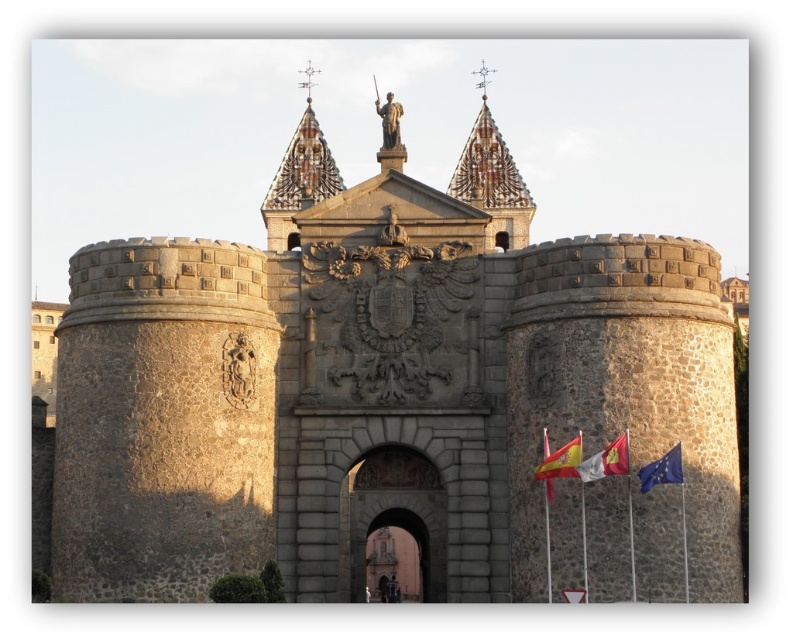
Where is `white fabric flag at lower right`? The image size is (793, 640). white fabric flag at lower right is located at coordinates (606, 460).

Does white fabric flag at lower right have a larger size compared to blue fabric flag at lower right?

No.

Where is `white fabric flag at lower right`? white fabric flag at lower right is located at coordinates (606, 460).

Between stone archway at center and red fabric flag at center, which one has less height?

With less height is red fabric flag at center.

Can you confirm if stone archway at center is taller than red fabric flag at center?

Indeed, stone archway at center has a greater height compared to red fabric flag at center.

Who is more forward, (377, 515) or (546, 428)?

Positioned in front is point (546, 428).

Image resolution: width=793 pixels, height=640 pixels. In order to click on stone archway at center in this screenshot , I will do `click(397, 552)`.

Can you confirm if blue fabric flag at lower right is shorter than red fabric flag at center?

No, blue fabric flag at lower right is not shorter than red fabric flag at center.

Based on the photo, can you confirm if blue fabric flag at lower right is positioned below red fabric flag at center?

No.

Is point (680, 467) behind point (550, 497)?

No, it is not.

Where is `blue fabric flag at lower right`? This screenshot has width=793, height=640. blue fabric flag at lower right is located at coordinates (661, 468).